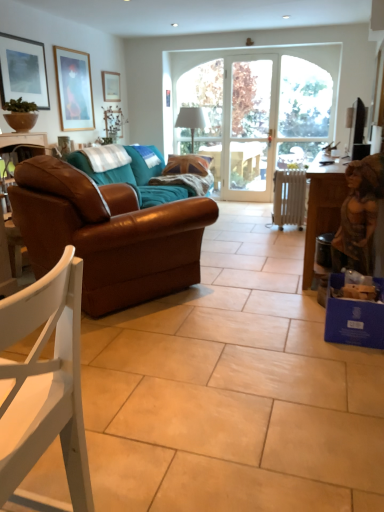
Question: From a real-world perspective, is brown leather couch at left above or below matte brown bowl at upper left?

Choices:
 (A) above
 (B) below

Answer: (B)

Question: Is brown leather couch at left to the left or to the right of matte brown bowl at upper left in the image?

Choices:
 (A) right
 (B) left

Answer: (A)

Question: Considering the real-world distances, which object is closest to the brown leather couch at left?

Choices:
 (A) matte black television at upper right
 (B) clear glass door at center
 (C) brown leather couch at left
 (D) wooden picture frame at upper left, acting as the 2th picture frame starting from the right
 (E) blue cardboard box at lower right

Answer: (C)

Question: Which of these objects is positioned farthest from the white matte chair at lower left?

Choices:
 (A) matte white picture frame at upper center, positioned as the first picture frame in back-to-front order
 (B) matte brown bowl at upper left
 (C) brown leather couch at left
 (D) white metallic radiator at center
 (E) brown leather couch at left

Answer: (A)